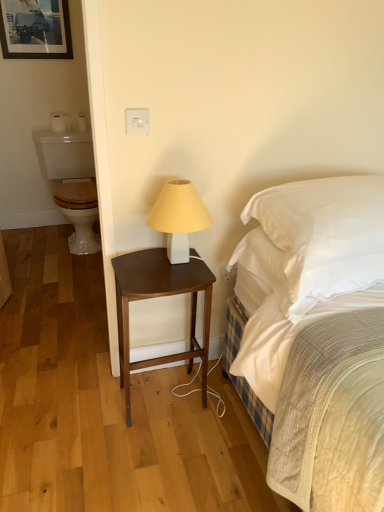
The image size is (384, 512). What do you see at coordinates (160, 296) in the screenshot? I see `dark wood nightstand at center` at bounding box center [160, 296].

You are a GUI agent. You are given a task and a screenshot of the screen. Output one action in this format:
    pyautogui.click(x=<x>, y=<y>)
    Task: Click on the dark wood nightstand at center
    This screenshot has height=512, width=384.
    Given the screenshot: What is the action you would take?
    pyautogui.click(x=160, y=296)

Image resolution: width=384 pixels, height=512 pixels. What do you see at coordinates (320, 237) in the screenshot?
I see `white satin pillow at upper right` at bounding box center [320, 237].

Identify the location of white glossy toilet at left. (72, 183).

Where is `dark wood nightstand at center`? dark wood nightstand at center is located at coordinates (160, 296).

Is white plastic electric outlet at lower center oriented away from matte black picture frame at upper left?

white plastic electric outlet at lower center is not turned away from matte black picture frame at upper left.

Which of these two, white plastic electric outlet at lower center or matte black picture frame at upper left, is smaller?

With smaller size is white plastic electric outlet at lower center.

Is white plastic electric outlet at lower center far away from matte black picture frame at upper left?

Yes, white plastic electric outlet at lower center and matte black picture frame at upper left are located far from each other.

Is white plastic electric outlet at lower center wider or thinner than white matte table lamp at center?

Clearly, white plastic electric outlet at lower center has less width compared to white matte table lamp at center.

From a real-world perspective, relative to white matte table lamp at center, is white plastic electric outlet at lower center vertically above or below?

In terms of real-world spatial position, white plastic electric outlet at lower center is below white matte table lamp at center.

How many degrees apart are the facing directions of white plastic electric outlet at lower center and white matte table lamp at center?

There is a 2-degree angle between the facing directions of white plastic electric outlet at lower center and white matte table lamp at center.

From the picture: Would you say white plastic electric outlet at lower center contains white matte table lamp at center?

No, white matte table lamp at center is not inside white plastic electric outlet at lower center.

Is matte black picture frame at upper left facing towards white matte table lamp at center?

Yes, matte black picture frame at upper left is aimed at white matte table lamp at center.

Considering the sizes of objects matte black picture frame at upper left and white matte table lamp at center in the image provided, who is smaller, matte black picture frame at upper left or white matte table lamp at center?

matte black picture frame at upper left is smaller.

Is point (57, 21) behind point (175, 181)?

Yes, point (57, 21) is behind point (175, 181).

Can you tell me how much matte black picture frame at upper left and white matte table lamp at center differ in facing direction?

The facing directions of matte black picture frame at upper left and white matte table lamp at center are 2.06 degrees apart.

Which object is thinner, white satin pillow at upper right or matte black picture frame at upper left?

Thinner between the two is matte black picture frame at upper left.

Is white satin pillow at upper right outside of matte black picture frame at upper left?

Yes.

From the image's perspective, is white satin pillow at upper right above or below matte black picture frame at upper left?

white satin pillow at upper right is below matte black picture frame at upper left.

From a real-world perspective, does white satin pillow at upper right stand above matte black picture frame at upper left?

No.

In order to click on nightstand below the white matte table lamp at center (from the image's perspective) in this screenshot , I will do point(160,296).

Considering the relative positions of white matte table lamp at center and dark wood nightstand at center in the image provided, is white matte table lamp at center to the left of dark wood nightstand at center from the viewer's perspective?

No.

Considering the relative positions of white matte table lamp at center and dark wood nightstand at center in the image provided, is white matte table lamp at center in front of dark wood nightstand at center?

Yes.

Considering the relative sizes of white matte table lamp at center and dark wood nightstand at center in the image provided, is white matte table lamp at center thinner than dark wood nightstand at center?

Yes, white matte table lamp at center is thinner than dark wood nightstand at center.

From the image's perspective, would you say white matte table lamp at center is shown under white satin pillow at upper right?

Yes, from the image's perspective, white matte table lamp at center is beneath white satin pillow at upper right.

Based on the photo, which object is closer to the camera taking this photo, white matte table lamp at center or white satin pillow at upper right?

white satin pillow at upper right.

Considering the sizes of objects white matte table lamp at center and white satin pillow at upper right in the image provided, who is wider, white matte table lamp at center or white satin pillow at upper right?

With larger width is white satin pillow at upper right.

Does point (58, 12) appear closer or farther from the camera than point (94, 214)?

Point (58, 12) is positioned farther from the camera compared to point (94, 214).

Are matte black picture frame at upper left and white glossy toilet at left making contact?

No, matte black picture frame at upper left is not touching white glossy toilet at left.

Based on their positions, is matte black picture frame at upper left located to the left or right of white glossy toilet at left?

matte black picture frame at upper left is to the left of white glossy toilet at left.

Is matte black picture frame at upper left inside or outside of white glossy toilet at left?

matte black picture frame at upper left is outside white glossy toilet at left.

This screenshot has width=384, height=512. Identify the location of electric outlet below the matte black picture frame at upper left (from the image's perspective). (227, 275).

Locate an element on the screen. The height and width of the screenshot is (512, 384). electric outlet that appears behind the white matte table lamp at center is located at coordinates (227, 275).

From the picture: When comparing their distances from white matte table lamp at center, does white glossy toilet at left or white plastic electric outlet at lower center seem further?

white glossy toilet at left is positioned further to the anchor white matte table lamp at center.

Which object lies nearer to the anchor point white matte table lamp at center, matte black picture frame at upper left or white satin pillow at upper right?

white satin pillow at upper right lies closer to white matte table lamp at center than the other object.

Based on their spatial positions, is white satin pillow at upper right or white glossy toilet at left further from matte black picture frame at upper left?

Among the two, white satin pillow at upper right is located further to matte black picture frame at upper left.

Looking at the image, which one is located closer to white glossy toilet at left, matte black picture frame at upper left or white satin pillow at upper right?

matte black picture frame at upper left lies closer to white glossy toilet at left than the other object.

Considering their positions, is white plastic electric outlet at lower center positioned further to white glossy toilet at left than white satin pillow at upper right?

white satin pillow at upper right.

Which object lies further to the anchor point white matte table lamp at center, white glossy toilet at left or matte black picture frame at upper left?

matte black picture frame at upper left.

Considering their positions, is white glossy toilet at left positioned further to dark wood nightstand at center than white matte table lamp at center?

Based on the image, white glossy toilet at left appears to be further to dark wood nightstand at center.

Estimate the real-world distances between objects in this image. Which object is closer to matte black picture frame at upper left, dark wood nightstand at center or white glossy toilet at left?

white glossy toilet at left.

The image size is (384, 512). In order to click on electric outlet located between white matte table lamp at center and white glossy toilet at left in the depth direction in this screenshot , I will do `click(227, 275)`.

Locate an element on the screen. The width and height of the screenshot is (384, 512). electric outlet between white satin pillow at upper right and white glossy toilet at left from front to back is located at coordinates (227, 275).

Where is `pillow between matte black picture frame at upper left and dark wood nightstand at center from top to bottom`? The image size is (384, 512). pillow between matte black picture frame at upper left and dark wood nightstand at center from top to bottom is located at coordinates (320, 237).

Image resolution: width=384 pixels, height=512 pixels. What are the coordinates of `electric outlet between matte black picture frame at upper left and dark wood nightstand at center in the vertical direction` in the screenshot? It's located at (227, 275).